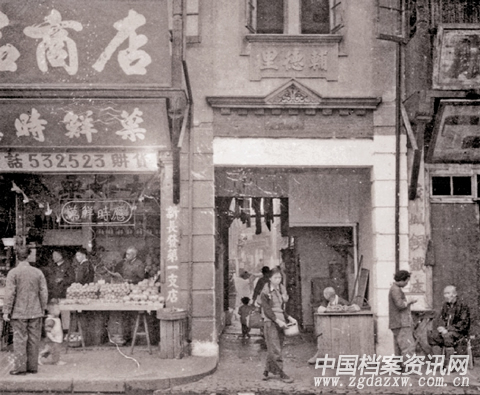
The image size is (480, 395). In order to click on table in this screenshot , I will do `click(115, 306)`.